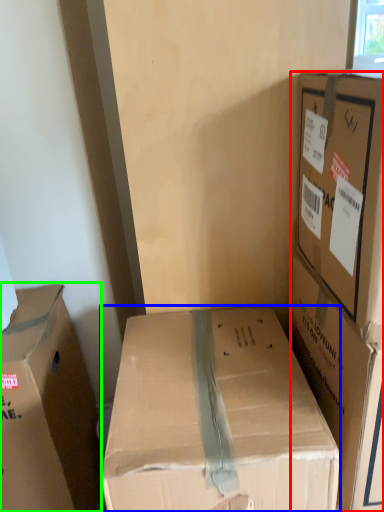
Question: Based on their relative distances, which object is nearer to box (highlighted by a red box)? Choose from box (highlighted by a blue box) and box (highlighted by a green box).

Choices:
 (A) box
 (B) box

Answer: (A)